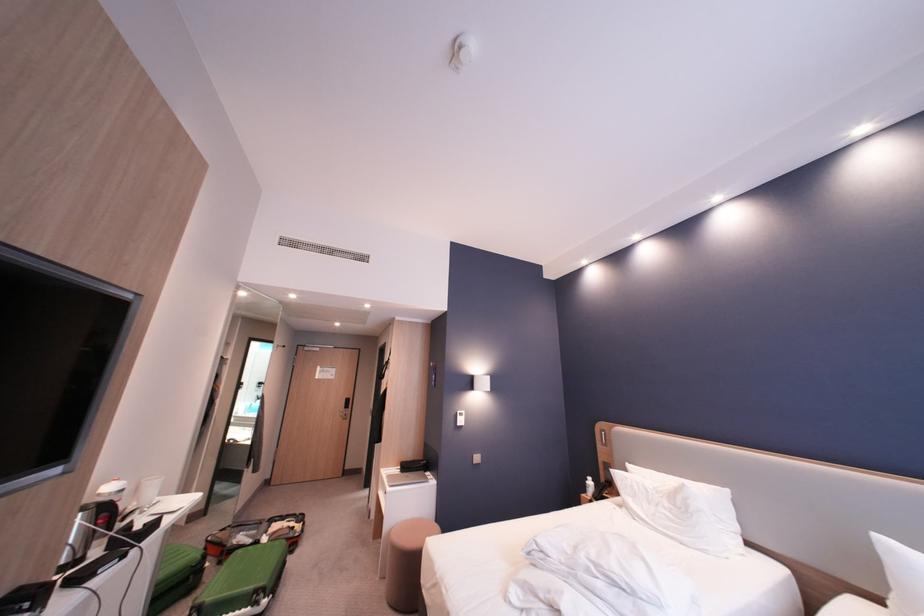
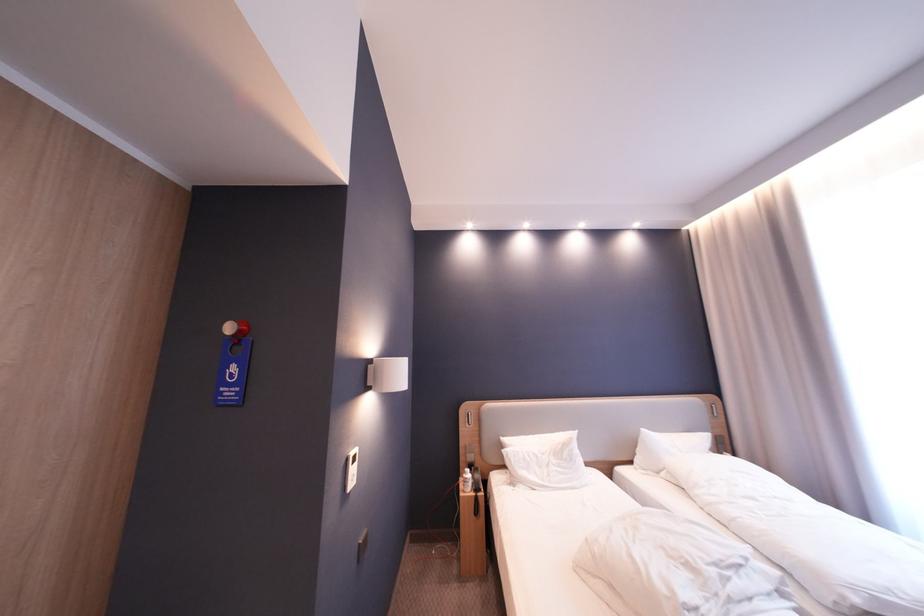
Locate, in the second image, the point that corresponds to pixel 444 377 in the first image.

(245, 370)